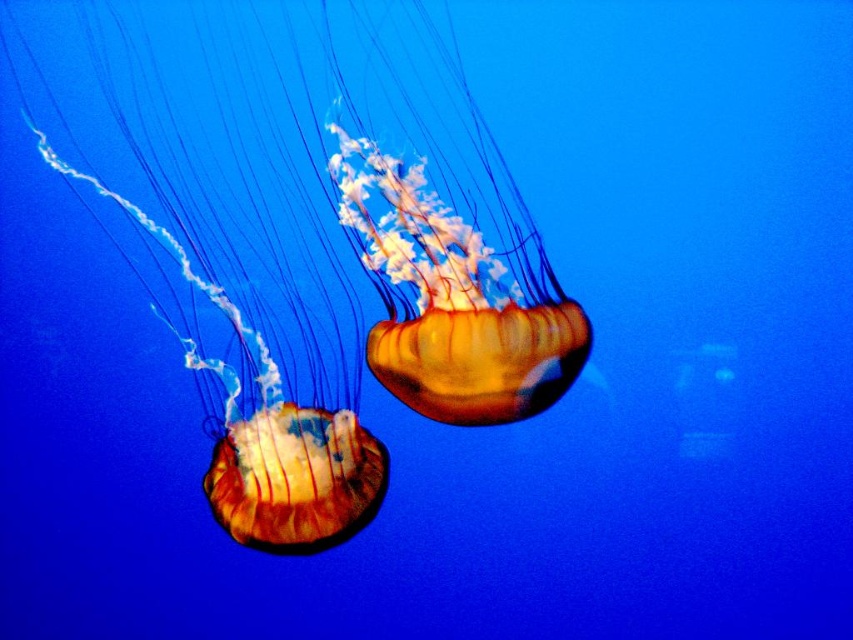
Question: Can you confirm if translucent orange jellyfish at left is bigger than translucent orange jellyfish at center?

Choices:
 (A) no
 (B) yes

Answer: (B)

Question: Does translucent orange jellyfish at left appear over translucent orange jellyfish at center?

Choices:
 (A) no
 (B) yes

Answer: (A)

Question: Which point appears farthest from the camera in this image?

Choices:
 (A) (477, 308)
 (B) (149, 144)

Answer: (A)

Question: Does translucent orange jellyfish at left appear under translucent orange jellyfish at center?

Choices:
 (A) yes
 (B) no

Answer: (A)